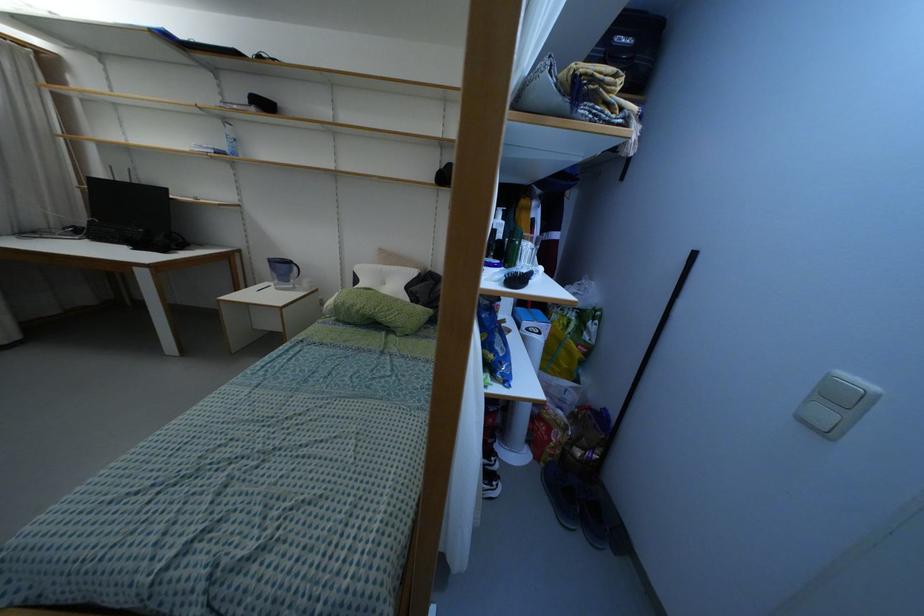
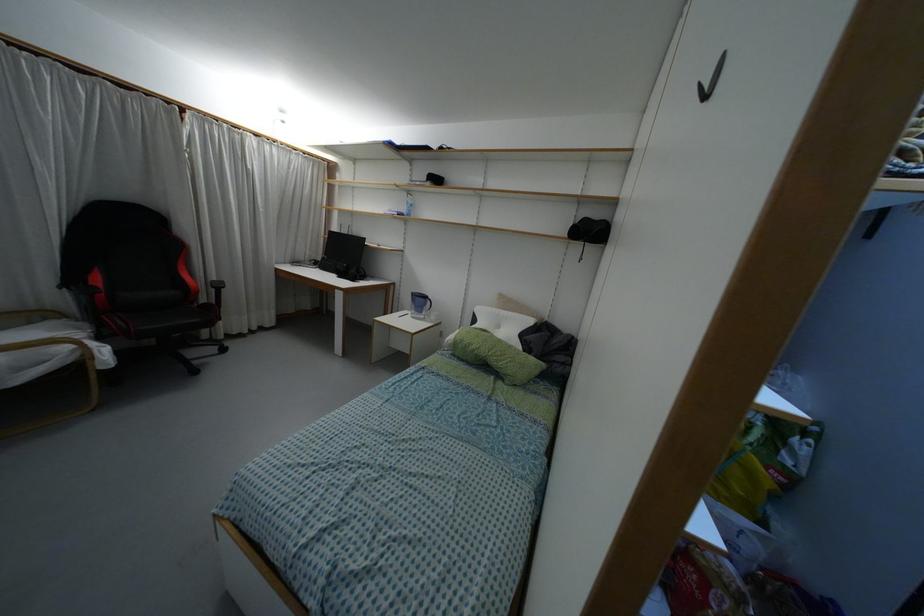
The point at (225, 120) is marked in the first image. Where is the corresponding point in the second image?

(407, 192)